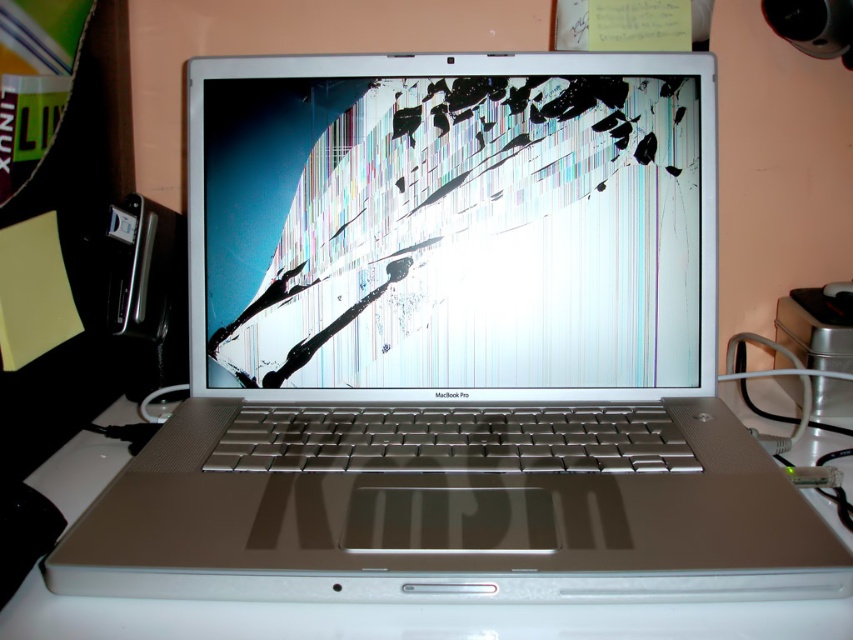
Is point (252, 321) positioned in front of point (39, 484)?

No, (252, 321) is behind (39, 484).

Which is more to the left, cracked glass screen at center or white matte table at center?

cracked glass screen at center

The width and height of the screenshot is (853, 640). Identify the location of cracked glass screen at center. (453, 230).